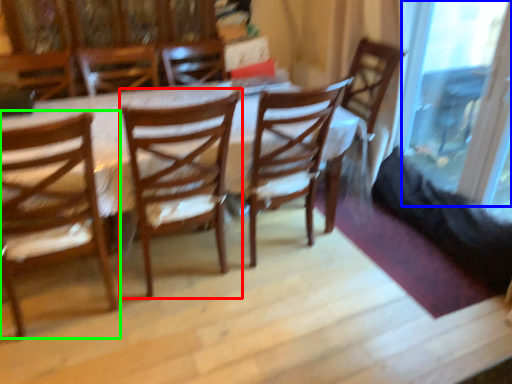
Question: Considering the real-world distances, which object is closest to chair (highlighted by a red box)? glass door (highlighted by a blue box) or chair (highlighted by a green box).

Choices:
 (A) glass door
 (B) chair

Answer: (B)